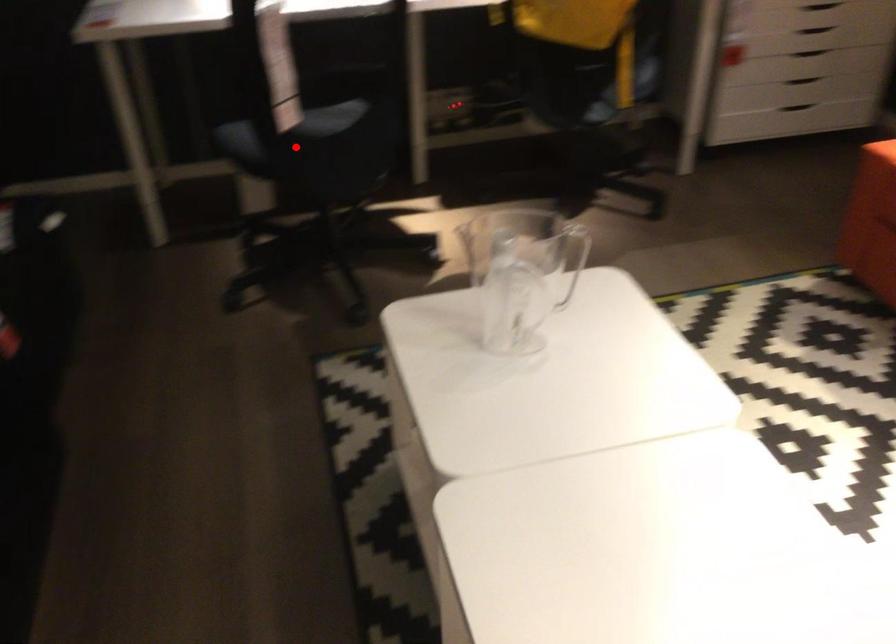
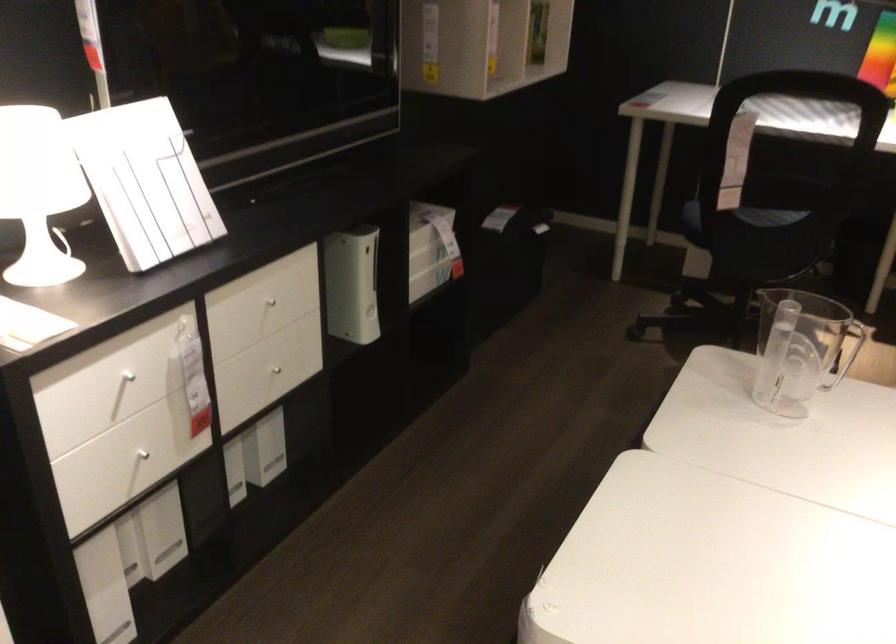
Question: I am providing you with two images of the same scene from different viewpoints. A red point is shown in image1. For the corresponding object point in image2, is it positioned nearer or farther from the camera?

Choices:
 (A) Nearer
 (B) Farther

Answer: (B)